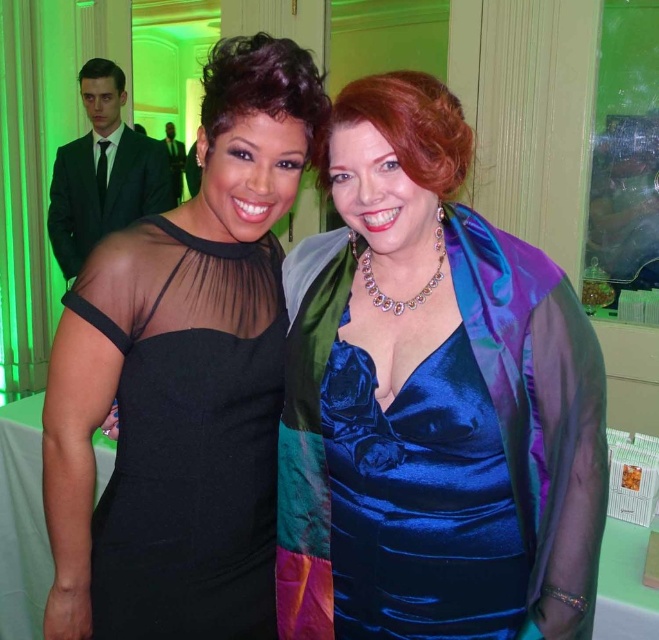
You are a photographer at a formal event. You need to adjust the lighting to ensure both the satin blue dress at center and the black sheer dress at center are well lit. Based on their positions, which dress is lower and might need more downward lighting adjustment?

The satin blue dress at center is below the black sheer dress at center, so it might need more downward lighting adjustment to ensure proper illumination.